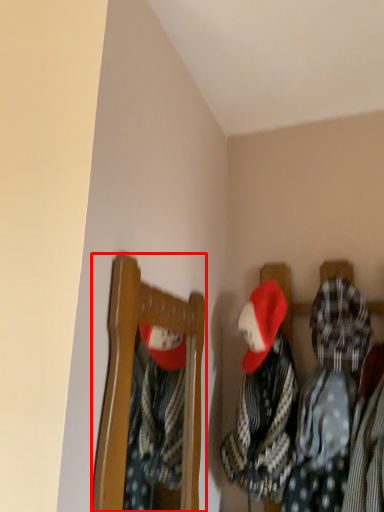
Question: Where is furniture (annotated by the red box) located in relation to clothing in the image?

Choices:
 (A) right
 (B) left

Answer: (B)